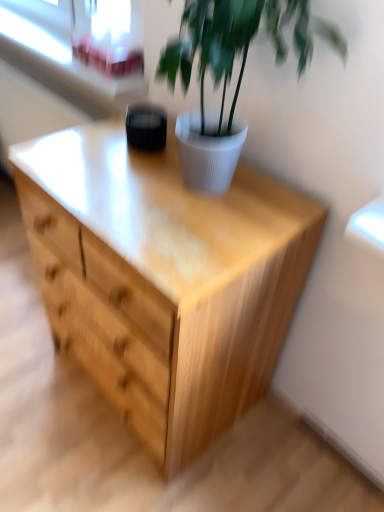
The image size is (384, 512). Identify the location of blank space above natural wood chest of drawers at center (from a real-world perspective). (159, 190).